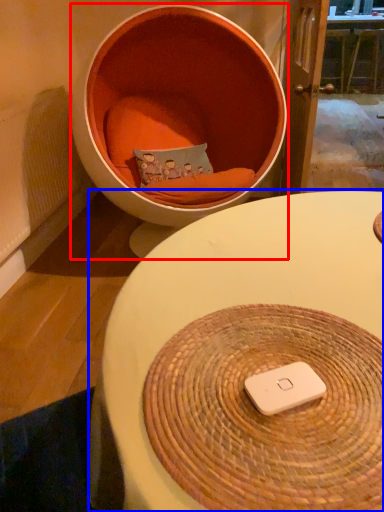
Question: Which of the following is the closest to the observer, furniture (highlighted by a red box) or table (highlighted by a blue box)?

Choices:
 (A) furniture
 (B) table

Answer: (B)